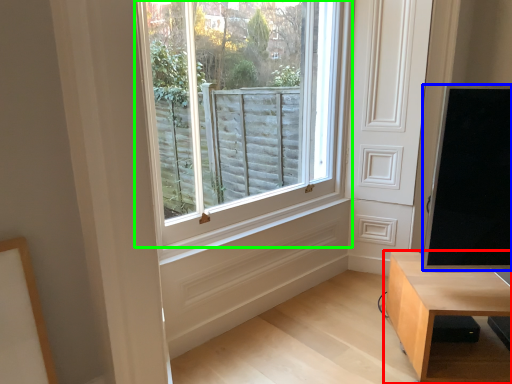
Question: Based on their relative distances, which object is farther from table (highlighted by a red box)? Choose from window screen (highlighted by a blue box) and window (highlighted by a green box).

Choices:
 (A) window screen
 (B) window

Answer: (B)